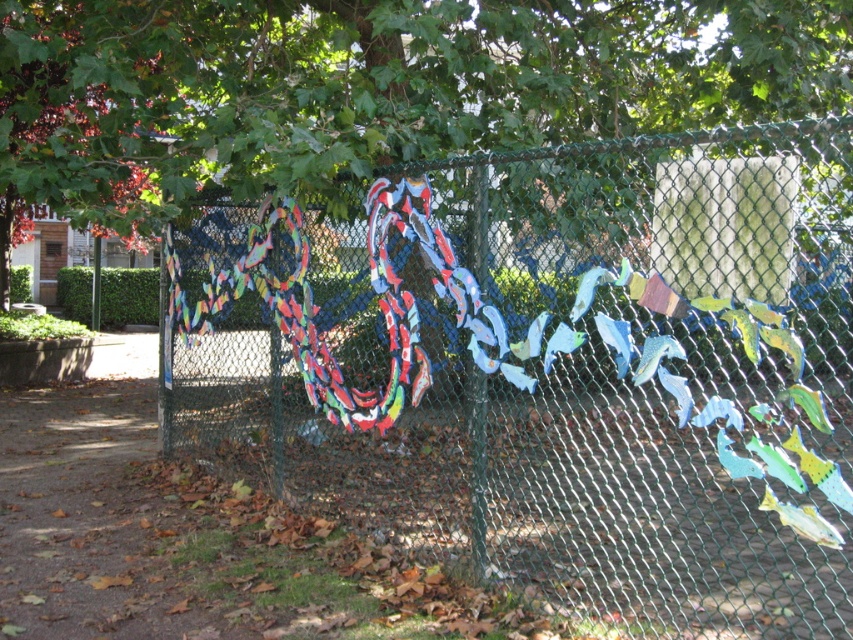
Is metallic chain-link fence at center to the right of green leafy tree at upper center from the viewer's perspective?

Correct, you'll find metallic chain-link fence at center to the right of green leafy tree at upper center.

Does point (476, 298) come farther from viewer compared to point (814, 113)?

No, (476, 298) is in front of (814, 113).

Find the location of a particular element. The width and height of the screenshot is (853, 640). metallic chain-link fence at center is located at coordinates (555, 369).